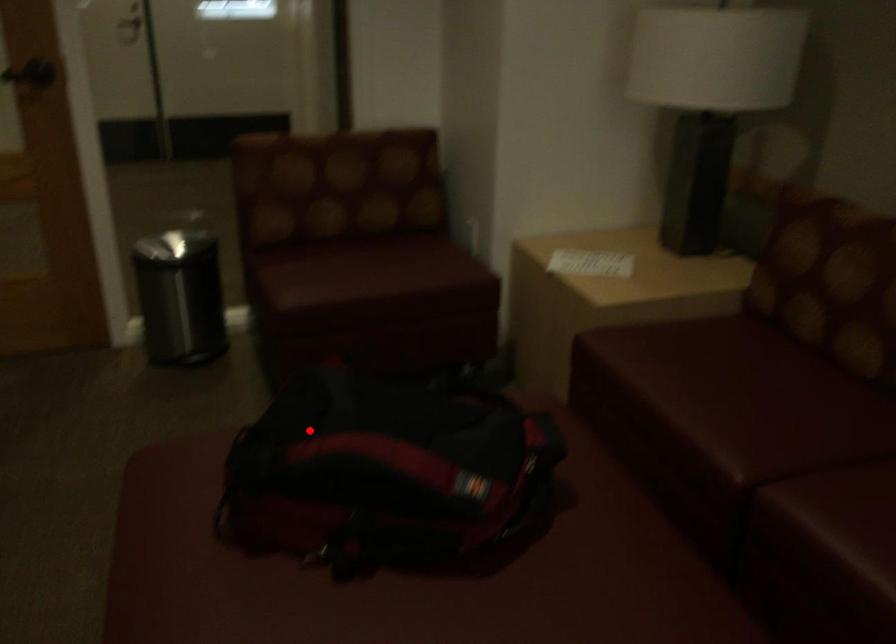
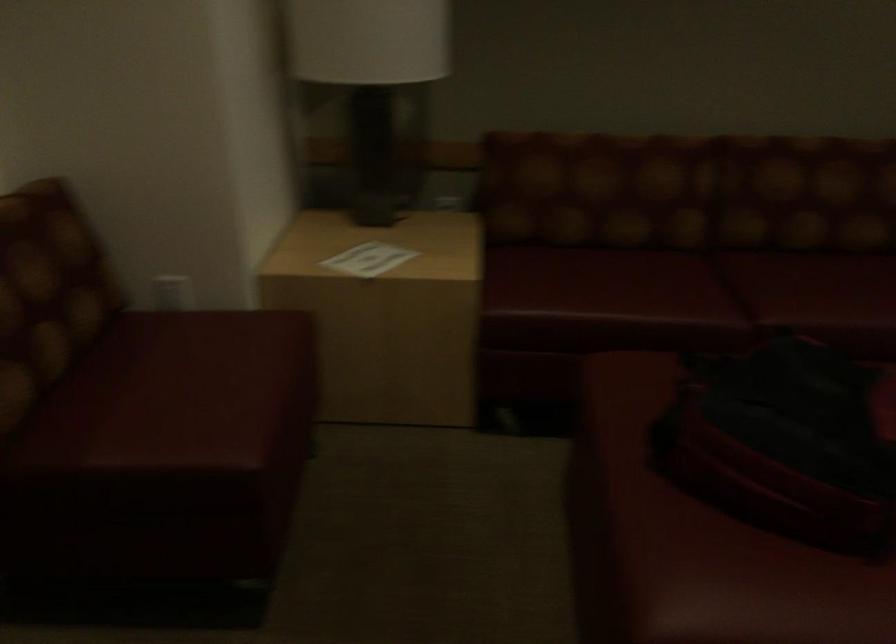
The point at the highlighted location is marked in the first image. Where is the corresponding point in the second image?

(786, 442)